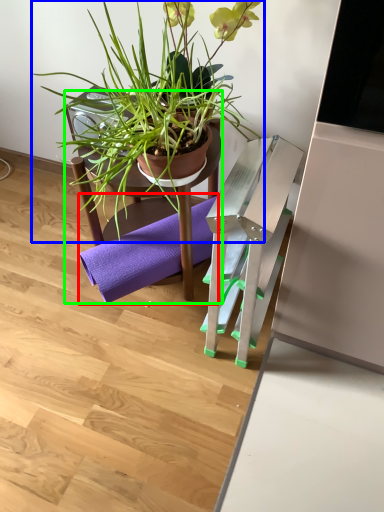
Question: Estimate the real-world distances between objects in this image. Which object is closer to yoga mat (highlighted by a red box), houseplant (highlighted by a blue box) or chair (highlighted by a green box)?

Choices:
 (A) houseplant
 (B) chair

Answer: (B)